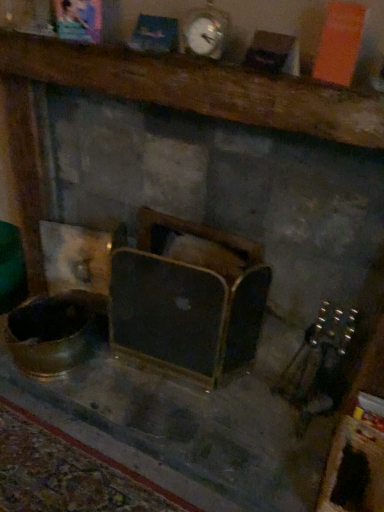
Question: From the image's perspective, is wooden mantel at upper center, which is counted as the 2th furniture, starting from the bottom, located above or below wooden framed mirror at center, placed as the first furniture when sorted from bottom to top?

Choices:
 (A) below
 (B) above

Answer: (B)

Question: In the image, is wooden mantel at upper center, which is counted as the 2th furniture, starting from the bottom, on the left side or the right side of wooden framed mirror at center, placed as the first furniture when sorted from bottom to top?

Choices:
 (A) left
 (B) right

Answer: (B)

Question: Which object is positioned farthest from the metallic silver clock at upper center?

Choices:
 (A) wooden mantel at upper center, which is the first furniture from top to bottom
 (B) wooden framed mirror at center, placed as the first furniture when sorted from bottom to top

Answer: (B)

Question: Which of these objects is positioned farthest from the wooden framed mirror at center, which is counted as the 2th furniture, starting from the top?

Choices:
 (A) metallic silver clock at upper center
 (B) wooden mantel at upper center, which is the first furniture from top to bottom

Answer: (A)